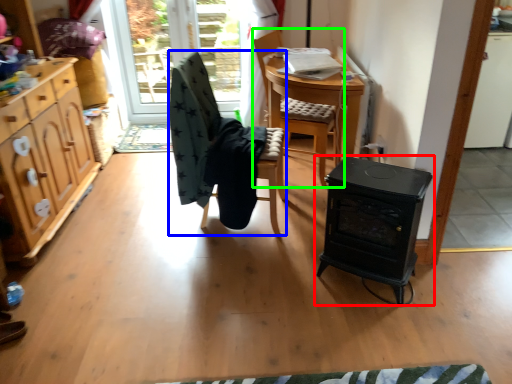
Question: Which object is the closest to the table (highlighted by a red box)? Choose among these: chair (highlighted by a blue box) or chair (highlighted by a green box).

Choices:
 (A) chair
 (B) chair

Answer: (A)